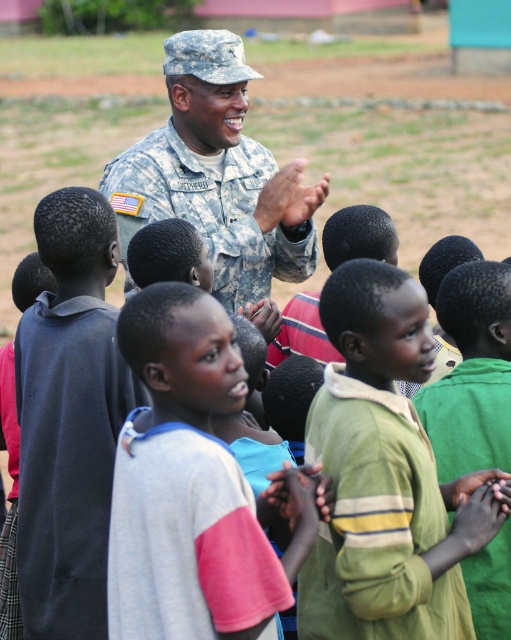
You are a photographer at the event and need to capture a photo of both the green cotton shirt at center and the green textured shirt at center. Which shirt should you focus on first to ensure it fits in the frame?

You should focus on the green cotton shirt at center first because it is larger in size than the green textured shirt at center, so it requires more space in the frame.